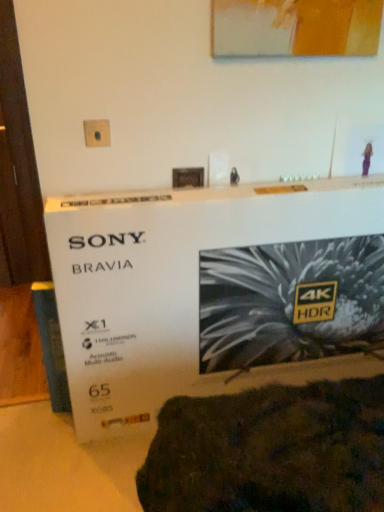
What do you see at coordinates (210, 289) in the screenshot?
I see `white cardboard box at center` at bounding box center [210, 289].

What are the coordinates of `matte plastic outlet at upper center` in the screenshot? It's located at (97, 133).

Is white cardboard box at center located within matte plastic outlet at upper center?

That's incorrect, white cardboard box at center is not inside matte plastic outlet at upper center.

From the picture: From the image's perspective, is matte plastic outlet at upper center under white cardboard box at center?

No, from the image's perspective, matte plastic outlet at upper center is not beneath white cardboard box at center.

Does matte plastic outlet at upper center touch white cardboard box at center?

There is a gap between matte plastic outlet at upper center and white cardboard box at center.

Based on their positions, is matte acrylic picture frame at upper center located to the left or right of white cardboard box at center?

Clearly, matte acrylic picture frame at upper center is on the right of white cardboard box at center in the image.

How different are the orientations of matte acrylic picture frame at upper center and white cardboard box at center in degrees?

The facing directions of matte acrylic picture frame at upper center and white cardboard box at center are 0.15 degrees apart.

Choose the correct answer: Is matte acrylic picture frame at upper center inside white cardboard box at center or outside it?

matte acrylic picture frame at upper center is not inside white cardboard box at center, it's outside.

Which is behind, matte acrylic picture frame at upper center or white cardboard box at center?

matte acrylic picture frame at upper center.

Between white cardboard box at center and matte plastic outlet at upper center, which one has larger size?

white cardboard box at center.

The image size is (384, 512). Find the location of `electric outlet on the left of white cardboard box at center`. electric outlet on the left of white cardboard box at center is located at coordinates (97, 133).

Is there a large distance between white cardboard box at center and matte plastic outlet at upper center?

white cardboard box at center is actually quite close to matte plastic outlet at upper center.

From a real-world perspective, is white cardboard box at center located beneath matte plastic outlet at upper center?

Indeed, from a real-world perspective, white cardboard box at center is positioned beneath matte plastic outlet at upper center.

How many degrees apart are the facing directions of white cardboard box at center and matte acrylic picture frame at upper center?

white cardboard box at center and matte acrylic picture frame at upper center are facing 0.15 degrees away from each other.

Based on their positions, is white cardboard box at center located to the left or right of matte acrylic picture frame at upper center?

From the image, it's evident that white cardboard box at center is to the left of matte acrylic picture frame at upper center.

Is white cardboard box at center oriented away from matte acrylic picture frame at upper center?

No, matte acrylic picture frame at upper center is not at the back of white cardboard box at center.

Is matte plastic outlet at upper center looking in the opposite direction of matte acrylic picture frame at upper center?

matte plastic outlet at upper center does not have its back to matte acrylic picture frame at upper center.

From the image's perspective, which one is positioned higher, matte plastic outlet at upper center or matte acrylic picture frame at upper center?

matte acrylic picture frame at upper center appears higher in the image.

Between point (97, 131) and point (355, 16), which one is positioned in front?

The point (97, 131) is more forward.

Can we say matte plastic outlet at upper center lies outside matte acrylic picture frame at upper center?

That's correct, matte plastic outlet at upper center is outside of matte acrylic picture frame at upper center.

Considering the sizes of objects matte acrylic picture frame at upper center and matte plastic outlet at upper center in the image provided, who is taller, matte acrylic picture frame at upper center or matte plastic outlet at upper center?

matte acrylic picture frame at upper center is taller.

In the scene shown: Can you tell me how much matte acrylic picture frame at upper center and matte plastic outlet at upper center differ in facing direction?

They differ by 2.41 degrees in their facing directions.

Consider the image. Is matte plastic outlet at upper center located within matte acrylic picture frame at upper center?

No, matte acrylic picture frame at upper center does not contain matte plastic outlet at upper center.

Is matte acrylic picture frame at upper center in front of or behind matte plastic outlet at upper center in the image?

matte acrylic picture frame at upper center is in front of matte plastic outlet at upper center.

Find the location of `poster beneath the matte plastic outlet at upper center (from a real-world perspective)`. poster beneath the matte plastic outlet at upper center (from a real-world perspective) is located at coordinates (x=210, y=289).

Identify the location of poster on the left of matte acrylic picture frame at upper center. The image size is (384, 512). (210, 289).

Looking at this image, looking at the image, which one is located further to matte plastic outlet at upper center, white cardboard box at center or matte acrylic picture frame at upper center?

white cardboard box at center is further to matte plastic outlet at upper center.

From the image, which object appears to be nearer to matte plastic outlet at upper center, matte acrylic picture frame at upper center or white cardboard box at center?

matte acrylic picture frame at upper center is positioned closer to the anchor matte plastic outlet at upper center.

Consider the image. Estimate the real-world distances between objects in this image. Which object is further from white cardboard box at center, matte acrylic picture frame at upper center or matte plastic outlet at upper center?

matte acrylic picture frame at upper center.

Which object lies further to the anchor point white cardboard box at center, matte plastic outlet at upper center or matte acrylic picture frame at upper center?

matte acrylic picture frame at upper center lies further to white cardboard box at center than the other object.

From the image, which object appears to be farther from matte acrylic picture frame at upper center, white cardboard box at center or matte plastic outlet at upper center?

Based on the image, white cardboard box at center appears to be further to matte acrylic picture frame at upper center.

Which object lies further to the anchor point matte acrylic picture frame at upper center, matte plastic outlet at upper center or white cardboard box at center?

white cardboard box at center lies further to matte acrylic picture frame at upper center than the other object.

You are a GUI agent. You are given a task and a screenshot of the screen. Output one action in this format:
    pyautogui.click(x=<x>, y=<y>)
    Task: Click on the electric outlet between matte acrylic picture frame at upper center and white cardboard box at center from top to bottom
    The image size is (384, 512).
    Given the screenshot: What is the action you would take?
    pyautogui.click(x=97, y=133)